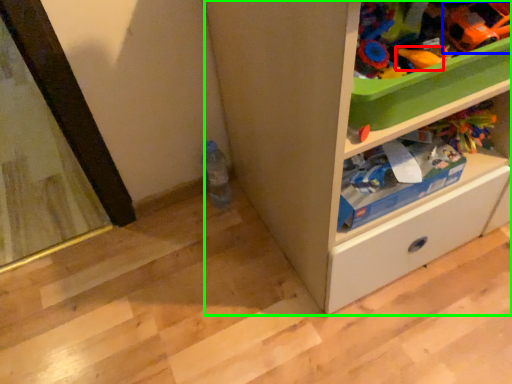
Question: Which object is the farthest from toy (highlighted by a red box)? Choose among these: toy (highlighted by a blue box) or cabinetry (highlighted by a green box).

Choices:
 (A) toy
 (B) cabinetry

Answer: (B)